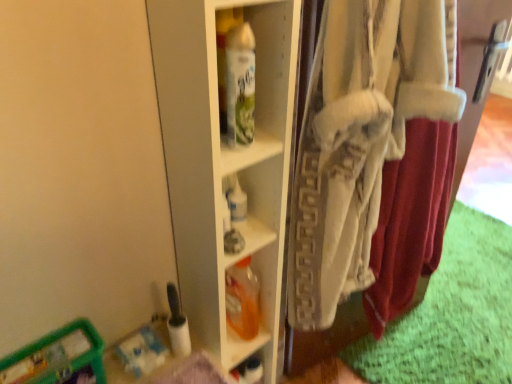
Question: Could you tell me if white glossy shelf at center is facing white cotton underclothes at right?

Choices:
 (A) no
 (B) yes

Answer: (A)

Question: Considering the relative sizes of white glossy shelf at center and white cotton underclothes at right in the image provided, is white glossy shelf at center bigger than white cotton underclothes at right?

Choices:
 (A) yes
 (B) no

Answer: (B)

Question: From a real-world perspective, is white glossy shelf at center on top of white cotton underclothes at right?

Choices:
 (A) no
 (B) yes

Answer: (A)

Question: From the image's perspective, is white glossy shelf at center on top of white cotton underclothes at right?

Choices:
 (A) yes
 (B) no

Answer: (A)

Question: Is white glossy shelf at center closer to camera compared to white cotton underclothes at right?

Choices:
 (A) yes
 (B) no

Answer: (B)

Question: Considering the positions of white glossy spray can at center, placed as the 1th bottle when sorted from front to back, and translucent plastic container at lower left in the image, is white glossy spray can at center, placed as the 1th bottle when sorted from front to back, wider or thinner than translucent plastic container at lower left?

Choices:
 (A) wide
 (B) thin

Answer: (B)

Question: Based on their positions, is white glossy spray can at center, placed as the 1th bottle when sorted from top to bottom, located to the left or right of translucent plastic container at lower left?

Choices:
 (A) right
 (B) left

Answer: (A)

Question: Relative to translucent plastic container at lower left, is white glossy spray can at center, the 2th bottle when ordered from bottom to top, in front or behind?

Choices:
 (A) behind
 (B) front

Answer: (B)

Question: Is white glossy spray can at center, placed as the 1th bottle when sorted from front to back, taller or shorter than translucent plastic container at lower left?

Choices:
 (A) tall
 (B) short

Answer: (A)

Question: Considering the positions of white cotton underclothes at right and white glossy spray can at center, the 2th bottle in the back-to-front sequence, in the image, is white cotton underclothes at right wider or thinner than white glossy spray can at center, the 2th bottle in the back-to-front sequence,?

Choices:
 (A) wide
 (B) thin

Answer: (A)

Question: Based on their positions, is white cotton underclothes at right located to the left or right of white glossy spray can at center, placed as the 1th bottle when sorted from top to bottom?

Choices:
 (A) right
 (B) left

Answer: (A)

Question: In terms of size, does white cotton underclothes at right appear bigger or smaller than white glossy spray can at center, placed as the 1th bottle when sorted from front to back?

Choices:
 (A) small
 (B) big

Answer: (B)

Question: From a real-world perspective, relative to white glossy spray can at center, the 2th bottle in the back-to-front sequence, is white cotton underclothes at right vertically above or below?

Choices:
 (A) above
 (B) below

Answer: (B)

Question: Is white cotton underclothes at right to the left or to the right of translucent orange plastic bottle at center, the 1th bottle when ordered from back to front, in the image?

Choices:
 (A) left
 (B) right

Answer: (B)

Question: Relative to translucent orange plastic bottle at center, the 2th bottle positioned from the top, is white cotton underclothes at right in front or behind?

Choices:
 (A) front
 (B) behind

Answer: (A)